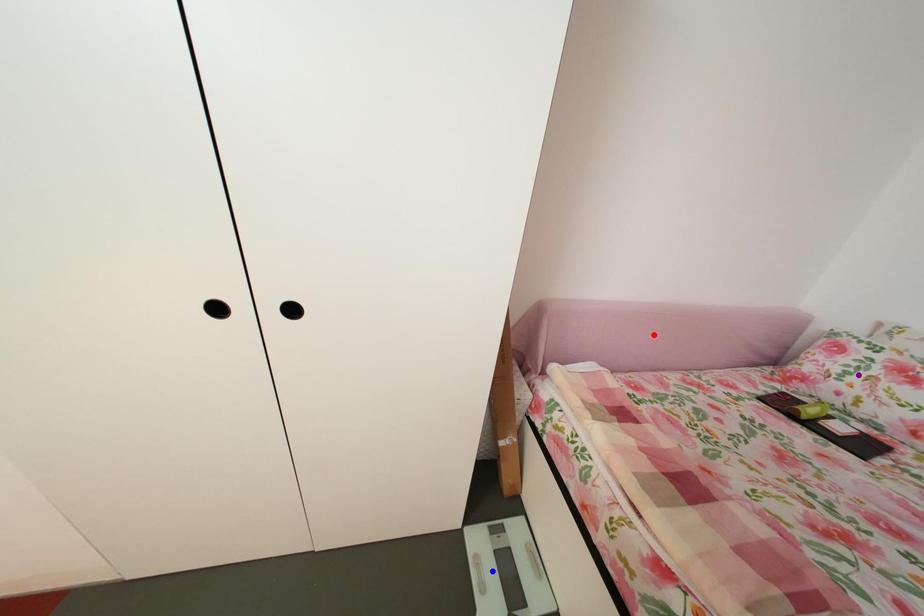
Order these from nearest to farthest:
red point | blue point | purple point

purple point
blue point
red point